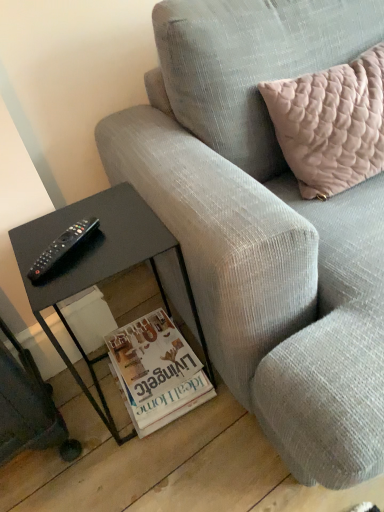
This screenshot has height=512, width=384. In order to click on empty space that is ontop of white glossy magazine at lower center in this screenshot , I will do `click(153, 368)`.